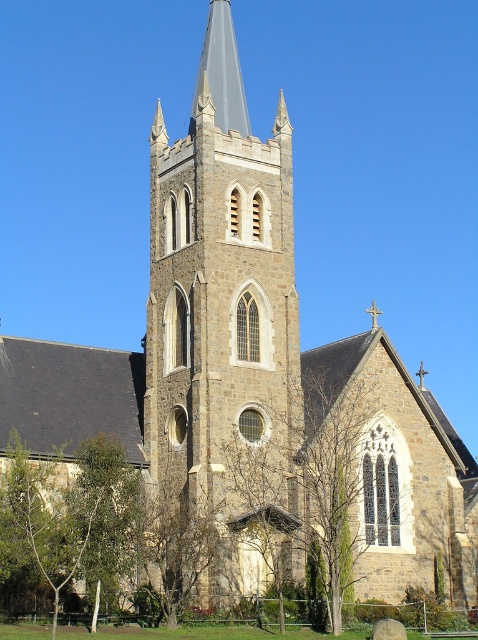
Which of these two, brown textured tree at lower center or smooth gray steeple at center, stands shorter?

brown textured tree at lower center is shorter.

Is point (189, 515) positioned in front of point (226, 35)?

That is True.

Locate an element on the screen. This screenshot has height=640, width=478. brown textured tree at lower center is located at coordinates (174, 545).

At what (x,y) coordinates should I click in order to perform the action: click on brown stone tower at center. Please return your answer as a coordinate pair (x, y). The height and width of the screenshot is (640, 478). Looking at the image, I should click on (218, 284).

Between point (155, 305) and point (225, 13), which one is positioned in front?

Point (155, 305) is in front.

Locate an element on the screen. brown stone tower at center is located at coordinates coord(218,284).

Consider the image. Is brown stone tower at center above brown textured tree at lower center?

Yes, brown stone tower at center is above brown textured tree at lower center.

Can you confirm if brown stone tower at center is positioned to the right of brown textured tree at lower center?

Correct, you'll find brown stone tower at center to the right of brown textured tree at lower center.

In order to click on brown stone tower at center in this screenshot , I will do `click(218, 284)`.